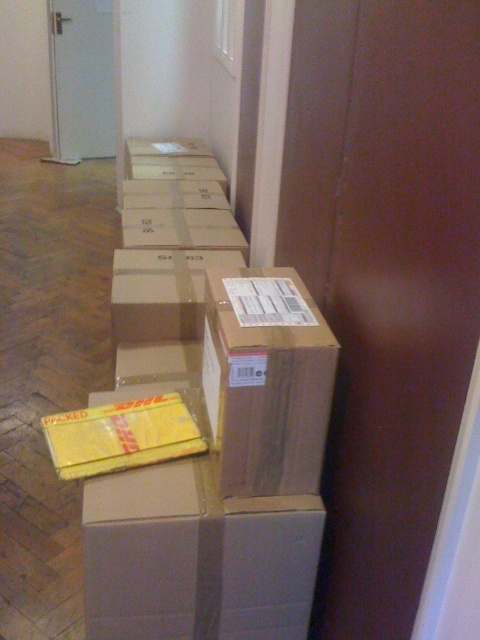
Can you confirm if matte cardboard box at center is positioned above brown cardboard box at center?

Incorrect, matte cardboard box at center is not positioned above brown cardboard box at center.

Between point (298, 538) and point (261, 300), which one is positioned behind?

Point (261, 300)

Where is `matte cardboard box at center`? matte cardboard box at center is located at coordinates (195, 557).